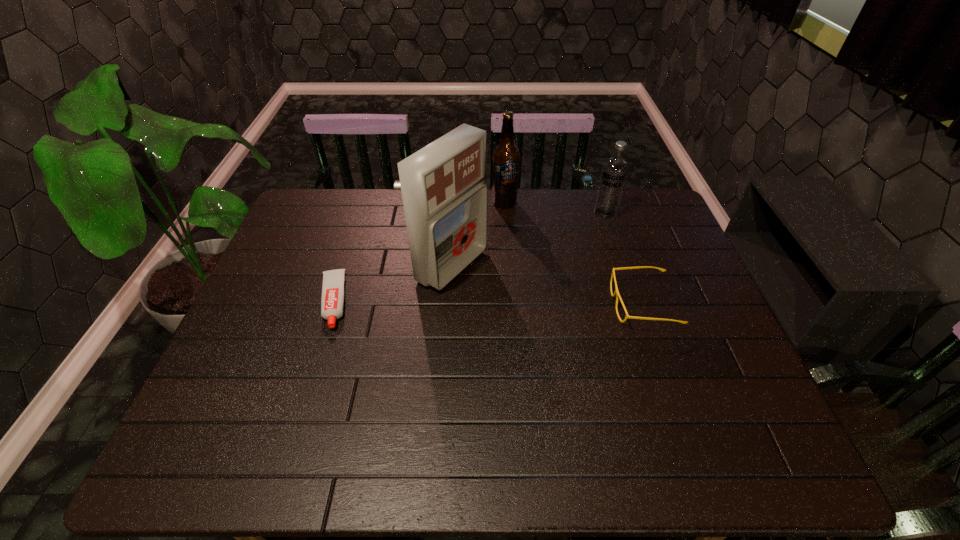
The image size is (960, 540). I want to click on free space on the desktop that is between the toothpaste and the second shortest object and is positioned on the front label of the third shortest object, so click(x=515, y=303).

At what (x,y) coordinates should I click in order to perform the action: click on free spot on the desktop that is between the leftmost object and the fourth tallest object and is positioned on the label of the third object from left to right. Please return your answer as a coordinate pair (x, y). The width and height of the screenshot is (960, 540). Looking at the image, I should click on (521, 303).

Locate an element on the screen. This screenshot has height=540, width=960. vacant spot on the desktop that is between the toothpaste and the spectacles and is positioned on the front-facing side of the tallest object is located at coordinates (524, 303).